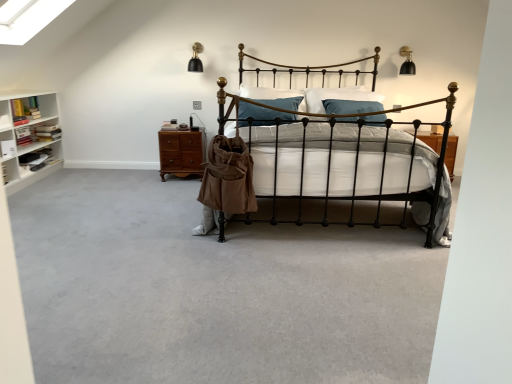
Identify the location of free space to the left of black wrought iron bed at center. The width and height of the screenshot is (512, 384). (121, 225).